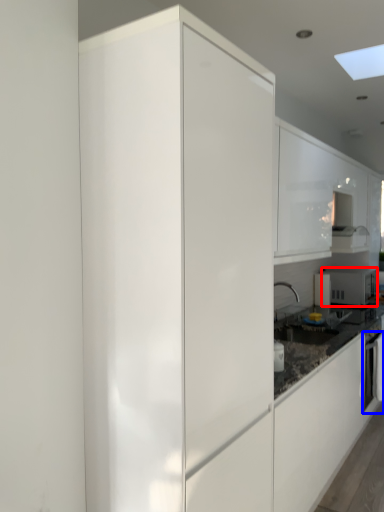
Question: Which point is closer to the camera, home appliance (highlighted by a red box) or oven (highlighted by a blue box)?

Choices:
 (A) home appliance
 (B) oven

Answer: (B)